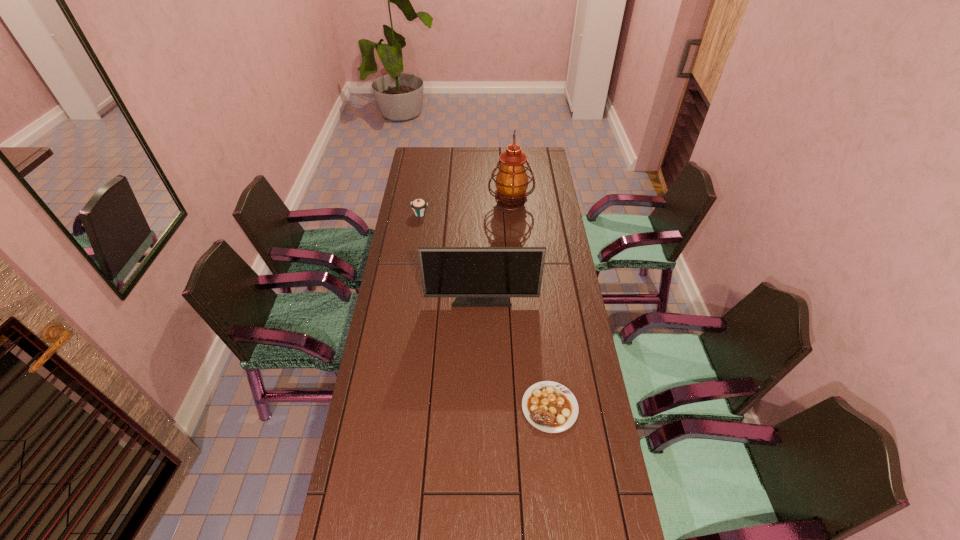
In the image, there is a desktop. Where is `vacant space at the far right corner`? vacant space at the far right corner is located at coordinates (543, 164).

Find the location of a particular element. This screenshot has height=540, width=960. free spot between the oil lamp and the second shortest object is located at coordinates (466, 210).

You are a GUI agent. You are given a task and a screenshot of the screen. Output one action in this format:
    pyautogui.click(x=<x>, y=<y>)
    Task: Click on the free space between the third tallest object and the nearest object
    This screenshot has width=960, height=540.
    Given the screenshot: What is the action you would take?
    pyautogui.click(x=485, y=310)

Where is `free area in between the oil lamp and the steak`? This screenshot has width=960, height=540. free area in between the oil lamp and the steak is located at coordinates (530, 306).

Identify the location of vacant area that lies between the oil lamp and the second shortest object. The image size is (960, 540). (466, 210).

Identify the location of vacant area that lies between the nearest object and the second tallest object. The width and height of the screenshot is (960, 540). (516, 353).

I want to click on vacant space in between the monitor and the steak, so click(516, 353).

The width and height of the screenshot is (960, 540). In order to click on vacant space that is in between the monitor and the nearest object in this screenshot , I will do [516, 353].

This screenshot has height=540, width=960. What are the coordinates of `vacant area that lies between the shortest object and the tallest object` in the screenshot? It's located at (530, 306).

You are a GUI agent. You are given a task and a screenshot of the screen. Output one action in this format:
    pyautogui.click(x=<x>, y=<y>)
    Task: Click on the vacant point located between the monitor and the steak
    This screenshot has width=960, height=540.
    Given the screenshot: What is the action you would take?
    pyautogui.click(x=516, y=353)